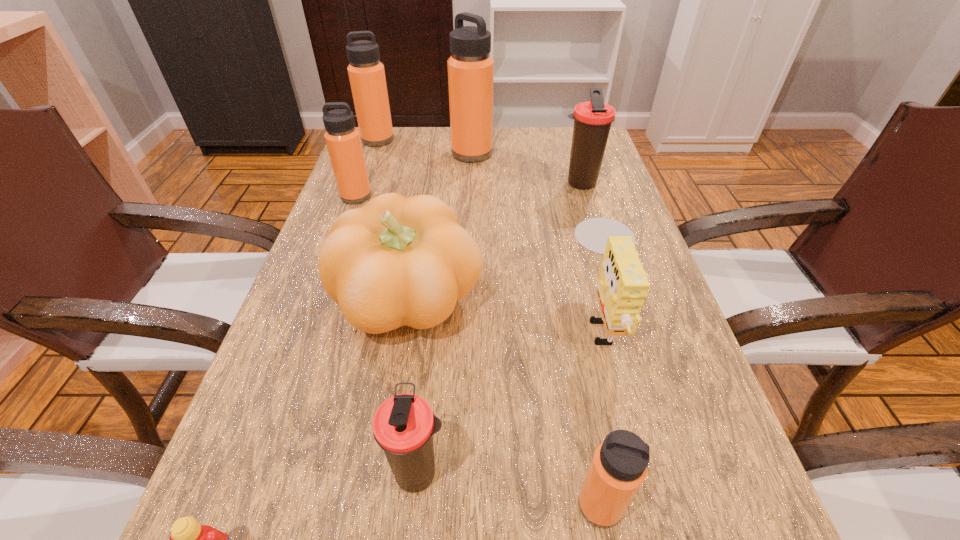
You are a GUI agent. You are given a task and a screenshot of the screen. Output one action in this format:
    pyautogui.click(x=<x>, y=<y>)
    Task: Click on the smaller brown thermos bottle
    
    Given the screenshot: What is the action you would take?
    pyautogui.click(x=403, y=426)

Where is `the nearest orange thermos bottle`? The width and height of the screenshot is (960, 540). the nearest orange thermos bottle is located at coordinates (618, 468).

Locate an element on the screen. the second thermos bottle from right to left is located at coordinates 618,468.

Locate an element on the screen. This screenshot has height=540, width=960. vacant space located on the back of the tallest thermos bottle is located at coordinates (472, 129).

The image size is (960, 540). What are the coordinates of `vacant space located on the right of the eighth shortest object` in the screenshot? It's located at (414, 140).

The image size is (960, 540). In order to click on vacant space located 0.170m on the front of the bigger brown thermos bottle in this screenshot , I will do `click(596, 236)`.

At what (x,y) coordinates should I click in order to perform the action: click on free space located 0.270m on the right of the second smallest orange thermos bottle. Please return your answer as a coordinate pair (x, y). Image resolution: width=960 pixels, height=540 pixels. Looking at the image, I should click on (477, 196).

Find the location of `free space located on the right of the pumpkin`. free space located on the right of the pumpkin is located at coordinates point(631,301).

You are a GUI agent. You are given a task and a screenshot of the screen. Output one action in this format:
    pyautogui.click(x=<x>, y=<y>)
    Task: Click on the free region located on the front-facing side of the sponge
    
    Given the screenshot: What is the action you would take?
    pyautogui.click(x=377, y=316)

Identify the location of vacant region located on the front-facing side of the sponge. 504,316.